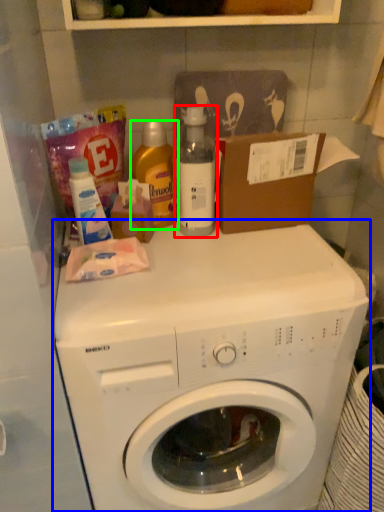
Question: Based on their relative distances, which object is farther from bottle (highlighted by a red box)? Choose from washing machine (highlighted by a blue box) and cleaning product (highlighted by a green box).

Choices:
 (A) washing machine
 (B) cleaning product

Answer: (A)